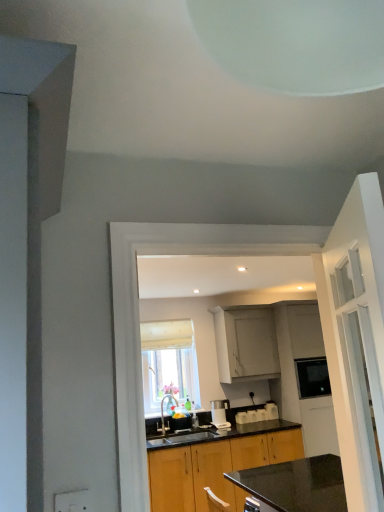
Image resolution: width=384 pixels, height=512 pixels. What do you see at coordinates (183, 438) in the screenshot? I see `black granite sink at center` at bounding box center [183, 438].

Where is `black granite sink at center`? The height and width of the screenshot is (512, 384). black granite sink at center is located at coordinates (183, 438).

At what (x,y) coordinates should I click in order to perform the action: click on white glass door at right. Please return your answer as a coordinate pair (x, y). Image resolution: width=384 pixels, height=512 pixels. Looking at the image, I should click on (356, 337).

The height and width of the screenshot is (512, 384). What do you see at coordinates (169, 364) in the screenshot? I see `white fabric window at center` at bounding box center [169, 364].

Identify the location of white matte cabinet at upper center, marked as the first cabinetry in a top-to-bottom arrangement. (246, 345).

What are the coordinates of `satin silver coffee machine at center` in the screenshot? It's located at (220, 414).

Is satin silver coffee machine at center placed right next to white glass door at right?

No, satin silver coffee machine at center is not making contact with white glass door at right.

How far apart are satin silver coffee machine at center and white glass door at right?

satin silver coffee machine at center and white glass door at right are 11.41 feet apart.

From a real-world perspective, is satin silver coffee machine at center on white glass door at right?

Actually, satin silver coffee machine at center is physically below white glass door at right in the real world.

At what (x,y) coordinates should I click in order to perform the action: click on coffee machine beneath the white glass door at right (from a real-world perspective). Please return your answer as a coordinate pair (x, y). This screenshot has width=384, height=512. Looking at the image, I should click on (220, 414).

Can you confirm if white matte cabinet at upper center, marked as the first cabinetry in a top-to-bottom arrangement, is bigger than wooden cabinet at center, the second cabinetry from the top?

No, white matte cabinet at upper center, marked as the first cabinetry in a top-to-bottom arrangement, is not bigger than wooden cabinet at center, the second cabinetry from the top.

Is white matte cabinet at upper center, marked as the 2th cabinetry in a bottom-to-top arrangement, outside of wooden cabinet at center, the 1th cabinetry when ordered from bottom to top?

Yes, white matte cabinet at upper center, marked as the 2th cabinetry in a bottom-to-top arrangement, is outside of wooden cabinet at center, the 1th cabinetry when ordered from bottom to top.

Is white matte cabinet at upper center, marked as the first cabinetry in a top-to-bottom arrangement, oriented towards wooden cabinet at center, the 1th cabinetry when ordered from bottom to top?

No, white matte cabinet at upper center, marked as the first cabinetry in a top-to-bottom arrangement, is not aimed at wooden cabinet at center, the 1th cabinetry when ordered from bottom to top.

Measure the distance from white matte cabinet at upper center, marked as the first cabinetry in a top-to-bottom arrangement, to wooden cabinet at center, the second cabinetry from the top.

white matte cabinet at upper center, marked as the first cabinetry in a top-to-bottom arrangement, is 35.17 inches from wooden cabinet at center, the second cabinetry from the top.

How far apart are white matte cabinet at upper center, marked as the first cabinetry in a top-to-bottom arrangement, and satin silver coffee machine at center?

white matte cabinet at upper center, marked as the first cabinetry in a top-to-bottom arrangement, and satin silver coffee machine at center are 61.66 centimeters apart.

Which is less distant, (254, 326) or (221, 416)?

Clearly, point (254, 326) is more distant from the camera than point (221, 416).

Does white matte cabinet at upper center, marked as the first cabinetry in a top-to-bottom arrangement, have a smaller size compared to satin silver coffee machine at center?

No.

Find the location of a particular element. This screenshot has height=512, width=384. cabinetry located on the right of satin silver coffee machine at center is located at coordinates (246, 345).

Is black granite sink at center outside of satin silver coffee machine at center?

Indeed, black granite sink at center is completely outside satin silver coffee machine at center.

From a real-world perspective, is black granite sink at center under satin silver coffee machine at center?

Yes.

Considering the points (163, 442) and (212, 414), which point is behind, point (163, 442) or point (212, 414)?

The point (212, 414) is farther from the camera.

Considering the relative sizes of black granite sink at center and satin silver coffee machine at center in the image provided, is black granite sink at center wider than satin silver coffee machine at center?

Yes.

Does white fabric window at center turn towards wooden cabinet at center, the 1th cabinetry when ordered from bottom to top?

No, white fabric window at center is not facing towards wooden cabinet at center, the 1th cabinetry when ordered from bottom to top.

Is point (191, 350) closer or farther from the camera than point (298, 432)?

Point (191, 350) appears to be farther away from the viewer than point (298, 432).

From the image's perspective, which is below, white fabric window at center or wooden cabinet at center, the second cabinetry from the top?

wooden cabinet at center, the second cabinetry from the top, appears lower in the image.

Is white fabric window at center in front of or behind wooden cabinet at center, the second cabinetry from the top, in the image?

white fabric window at center is behind wooden cabinet at center, the second cabinetry from the top.

Choose the correct answer: Is wooden cabinet at center, the 1th cabinetry when ordered from bottom to top, inside brushed metal faucet at center or outside it?

The correct answer is: outside.

From a real-world perspective, is wooden cabinet at center, the second cabinetry from the top, physically below brushed metal faucet at center?

Yes.

Is wooden cabinet at center, the second cabinetry from the top, far away from brushed metal faucet at center?

Actually, wooden cabinet at center, the second cabinetry from the top, and brushed metal faucet at center are a little close together.

Locate an element on the screen. tap lying on the left of wooden cabinet at center, the second cabinetry from the top is located at coordinates (163, 412).

Consider the image. From the image's perspective, which is below, satin silver coffee machine at center or black granite sink at center?

black granite sink at center, from the image's perspective.

From the picture: Is satin silver coffee machine at center further to camera compared to black granite sink at center?

Yes, the depth of satin silver coffee machine at center is greater than that of black granite sink at center.

Is satin silver coffee machine at center far from black granite sink at center?

No, satin silver coffee machine at center is not far from black granite sink at center.

In the scene shown: Is black granite sink at center at the back of satin silver coffee machine at center?

No, satin silver coffee machine at center is not facing away from black granite sink at center.

The width and height of the screenshot is (384, 512). What are the coordinates of `door on the right of satin silver coffee machine at center` in the screenshot? It's located at coord(356,337).

The height and width of the screenshot is (512, 384). What are the coordinates of `cabinetry in front of the white matte cabinet at upper center, marked as the 2th cabinetry in a bottom-to-top arrangement` in the screenshot? It's located at (215, 468).

Looking at the image, which one is located closer to white glass door at right, white fabric window at center or black granite sink at center?

black granite sink at center is closer to white glass door at right.

Which object lies further to the anchor point satin silver coffee machine at center, white fabric window at center or black granite sink at center?

white fabric window at center is positioned further to the anchor satin silver coffee machine at center.

Which object lies nearer to the anchor point white matte cabinet at upper center, marked as the first cabinetry in a top-to-bottom arrangement, wooden cabinet at center, the 1th cabinetry when ordered from bottom to top, or satin silver coffee machine at center?

satin silver coffee machine at center.

Estimate the real-world distances between objects in this image. Which object is further from black granite sink at center, white glass door at right or white fabric window at center?

Among the two, white glass door at right is located further to black granite sink at center.

Considering their positions, is white matte cabinet at upper center, marked as the first cabinetry in a top-to-bottom arrangement, positioned further to satin silver coffee machine at center than wooden cabinet at center, the 1th cabinetry when ordered from bottom to top?

The object further to satin silver coffee machine at center is white matte cabinet at upper center, marked as the first cabinetry in a top-to-bottom arrangement.

Based on their spatial positions, is white glass door at right or white plastic electric outlet at lower left closer to white fabric window at center?

Among the two, white glass door at right is located nearer to white fabric window at center.

Consider the image. Considering their positions, is wooden cabinet at center, the 1th cabinetry when ordered from bottom to top, positioned further to black granite sink at center than satin silver coffee machine at center?

satin silver coffee machine at center is further to black granite sink at center.

When comparing their distances from satin silver coffee machine at center, does wooden cabinet at center, the 1th cabinetry when ordered from bottom to top, or black granite sink at center seem further?

Based on the image, wooden cabinet at center, the 1th cabinetry when ordered from bottom to top, appears to be further to satin silver coffee machine at center.

At what (x,y) coordinates should I click in order to perform the action: click on sink between white fabric window at center and wooden cabinet at center, the 1th cabinetry when ordered from bottom to top, in the up-down direction. Please return your answer as a coordinate pair (x, y). Looking at the image, I should click on (183, 438).

I want to click on coffee machine that lies between white matte cabinet at upper center, marked as the first cabinetry in a top-to-bottom arrangement, and wooden cabinet at center, the 1th cabinetry when ordered from bottom to top, from top to bottom, so click(220, 414).

Image resolution: width=384 pixels, height=512 pixels. Identify the location of cabinetry positioned between white plastic electric outlet at lower left and satin silver coffee machine at center from near to far. (215, 468).

This screenshot has width=384, height=512. Identify the location of tap between white fabric window at center and black granite sink at center in the up-down direction. [x=163, y=412].